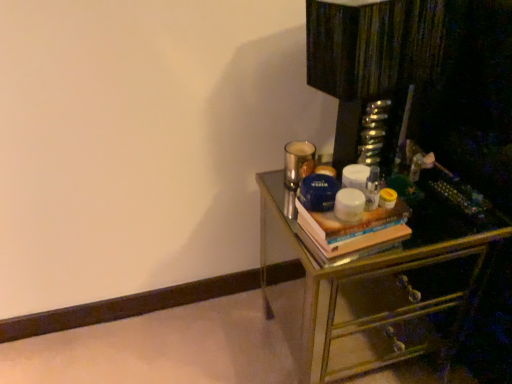
Identify the location of hardcover book at right. (355, 229).

What do you see at coordinates (355, 229) in the screenshot? This screenshot has height=384, width=512. I see `hardcover book at right` at bounding box center [355, 229].

What do you see at coordinates (416, 180) in the screenshot? I see `metallic mirrored chest of drawers at right` at bounding box center [416, 180].

At what (x,y) coordinates should I click in order to perform the action: click on metallic mirrored chest of drawers at right. Please return your answer as a coordinate pair (x, y). The height and width of the screenshot is (384, 512). Looking at the image, I should click on (416, 180).

Where is `hardcover book at right`? hardcover book at right is located at coordinates (355, 229).

Is metallic mirrored chest of drawers at right at the right side of hardcover book at right?

Indeed, metallic mirrored chest of drawers at right is positioned on the right side of hardcover book at right.

Relative to hardcover book at right, is metallic mirrored chest of drawers at right in front or behind?

Visually, metallic mirrored chest of drawers at right is located in front of hardcover book at right.

Which is farther, (460, 238) or (312, 216)?

Point (460, 238)

From the image's perspective, which one is positioned higher, metallic mirrored chest of drawers at right or hardcover book at right?

hardcover book at right is shown above in the image.

From a real-world perspective, is metallic mirrored chest of drawers at right positioned under hardcover book at right based on gravity?

Yes, from a real-world perspective, metallic mirrored chest of drawers at right is below hardcover book at right.

Considering the relative sizes of metallic mirrored chest of drawers at right and hardcover book at right in the image provided, is metallic mirrored chest of drawers at right thinner than hardcover book at right?

In fact, metallic mirrored chest of drawers at right might be wider than hardcover book at right.

Considering the relative sizes of metallic mirrored chest of drawers at right and hardcover book at right in the image provided, is metallic mirrored chest of drawers at right taller than hardcover book at right?

Indeed, metallic mirrored chest of drawers at right has a greater height compared to hardcover book at right.

Is metallic mirrored chest of drawers at right smaller than hardcover book at right?

No.

In the scene shown: Is metallic mirrored chest of drawers at right completely or partially outside of hardcover book at right?

Yes, metallic mirrored chest of drawers at right is not within hardcover book at right.

Is metallic mirrored chest of drawers at right next to hardcover book at right?

No, metallic mirrored chest of drawers at right is not next to hardcover book at right.

Is hardcover book at right at the back of metallic mirrored chest of drawers at right?

metallic mirrored chest of drawers at right is not turned away from hardcover book at right.

How many degrees apart are the facing directions of metallic mirrored chest of drawers at right and hardcover book at right?

There is a 8.24-degree angle between the facing directions of metallic mirrored chest of drawers at right and hardcover book at right.

Consider the image. How distant is metallic mirrored chest of drawers at right from hardcover book at right?

A distance of 12.02 inches exists between metallic mirrored chest of drawers at right and hardcover book at right.

Locate an element on the screen. This screenshot has width=512, height=384. the chest of drawers located below the hardcover book at right (from the image's perspective) is located at coordinates tap(416, 180).

Is hardcover book at right to the left or to the right of metallic mirrored chest of drawers at right in the image?

hardcover book at right is to the left of metallic mirrored chest of drawers at right.

Between hardcover book at right and metallic mirrored chest of drawers at right, which one is positioned in front?

metallic mirrored chest of drawers at right is in front.

Is point (314, 221) positioned after point (433, 125)?

No, it is in front of (433, 125).

From the image's perspective, which one is positioned higher, hardcover book at right or metallic mirrored chest of drawers at right?

hardcover book at right, from the image's perspective.

From a real-world perspective, does hardcover book at right sit lower than metallic mirrored chest of drawers at right?

Actually, hardcover book at right is physically above metallic mirrored chest of drawers at right in the real world.

Which object is thinner, hardcover book at right or metallic mirrored chest of drawers at right?

Thinner between the two is hardcover book at right.

In terms of height, does hardcover book at right look taller or shorter compared to metallic mirrored chest of drawers at right?

In the image, hardcover book at right appears to be shorter than metallic mirrored chest of drawers at right.

Considering the sizes of hardcover book at right and metallic mirrored chest of drawers at right in the image, is hardcover book at right bigger or smaller than metallic mirrored chest of drawers at right?

Considering their sizes, hardcover book at right takes up less space than metallic mirrored chest of drawers at right.

Would you say hardcover book at right is inside or outside metallic mirrored chest of drawers at right?

hardcover book at right cannot be found inside metallic mirrored chest of drawers at right.

Does hardcover book at right touch metallic mirrored chest of drawers at right?

No, hardcover book at right is not with metallic mirrored chest of drawers at right.

Is hardcover book at right aimed at metallic mirrored chest of drawers at right?

No, hardcover book at right is not aimed at metallic mirrored chest of drawers at right.

From the picture: Measure the distance from hardcover book at right to metallic mirrored chest of drawers at right.

hardcover book at right is 12.02 inches away from metallic mirrored chest of drawers at right.

Locate an element on the screen. The width and height of the screenshot is (512, 384). chest of drawers below the hardcover book at right (from a real-world perspective) is located at coordinates (416, 180).

This screenshot has height=384, width=512. Find the location of `book above the metallic mirrored chest of drawers at right (from the image's perspective)`. book above the metallic mirrored chest of drawers at right (from the image's perspective) is located at coordinates (355, 229).

You are a GUI agent. You are given a task and a screenshot of the screen. Output one action in this format:
    pyautogui.click(x=<x>, y=<y>)
    Task: Click on the book behind the metallic mirrored chest of drawers at right
    
    Given the screenshot: What is the action you would take?
    pyautogui.click(x=355, y=229)